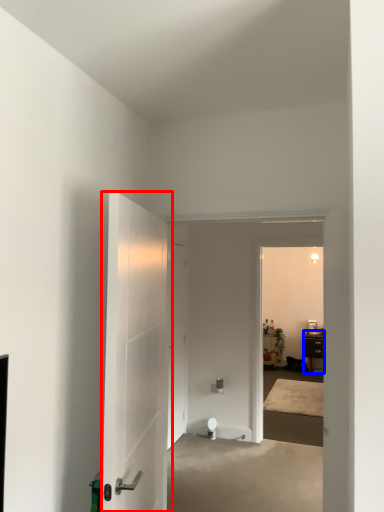
Question: Which of the following is the farthest to the observer, door (highlighted by a red box) or furniture (highlighted by a blue box)?

Choices:
 (A) door
 (B) furniture

Answer: (B)